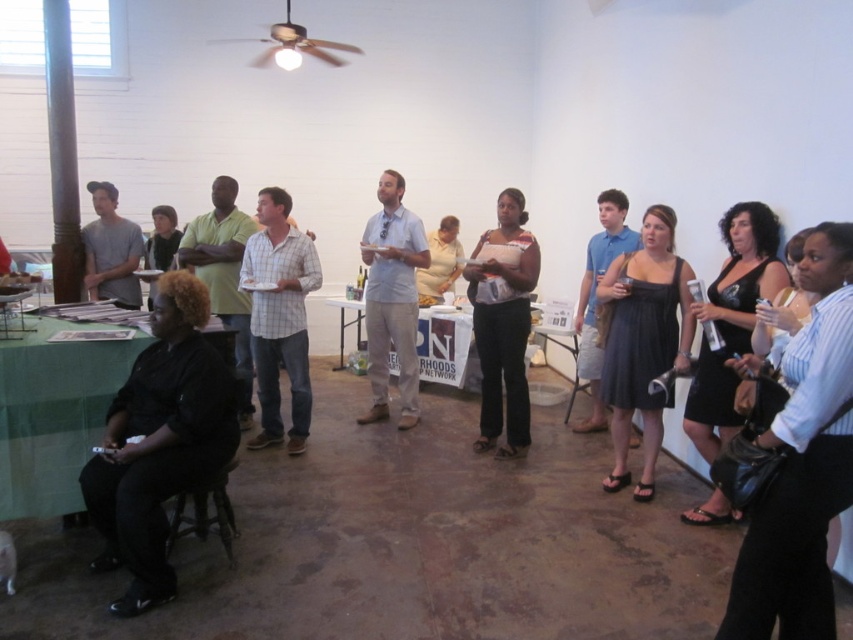
Question: Which of the following is the farthest from the observer?

Choices:
 (A) (138, 321)
 (B) (517, 211)
 (C) (102, 291)

Answer: (C)

Question: Is light blue cotton shirt at center wider than matte gray shirt at left?

Choices:
 (A) no
 (B) yes

Answer: (B)

Question: Which object is the farthest from the black dress at right?

Choices:
 (A) matte gray shirt at left
 (B) black satin dress at center-right
 (C) green fabric table at lower left
 (D) matte black dress at center

Answer: (A)

Question: Is matte black dress at center positioned before white paperboard at center?

Choices:
 (A) yes
 (B) no

Answer: (A)

Question: Considering the real-world distances, which object is closest to the black dress at right?

Choices:
 (A) white paperboard at center
 (B) matte black dress at center
 (C) light blue cotton shirt at center

Answer: (B)

Question: Observing the image, what is the correct spatial positioning of black dress at right in reference to matte black dress at center?

Choices:
 (A) above
 (B) below

Answer: (B)